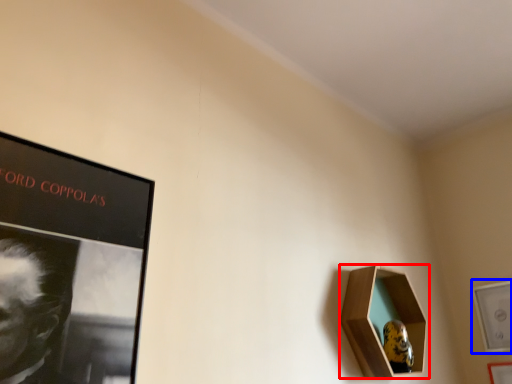
Question: Which of the following is the closest to the observer, picture frame (highlighted by a red box) or picture frame (highlighted by a blue box)?

Choices:
 (A) picture frame
 (B) picture frame

Answer: (A)